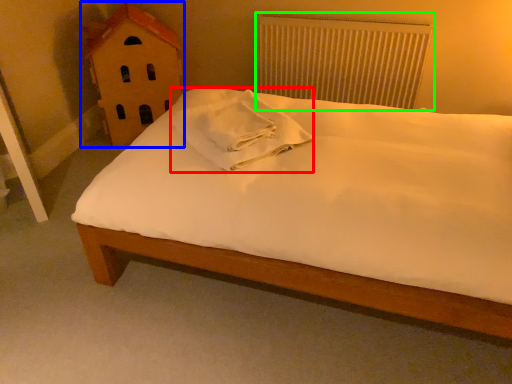
Question: Estimate the real-world distances between objects in this image. Which object is farther from material (highlighted by a red box), toy (highlighted by a blue box) or radiator (highlighted by a green box)?

Choices:
 (A) toy
 (B) radiator

Answer: (B)